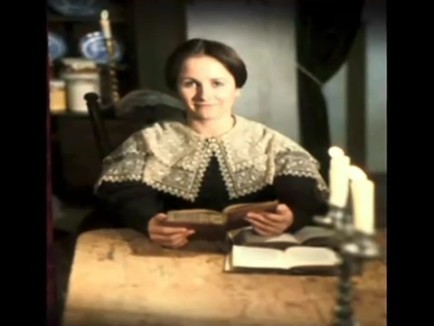
Locate an element on the screen. Image resolution: width=434 pixels, height=326 pixels. wall is located at coordinates (280, 48).